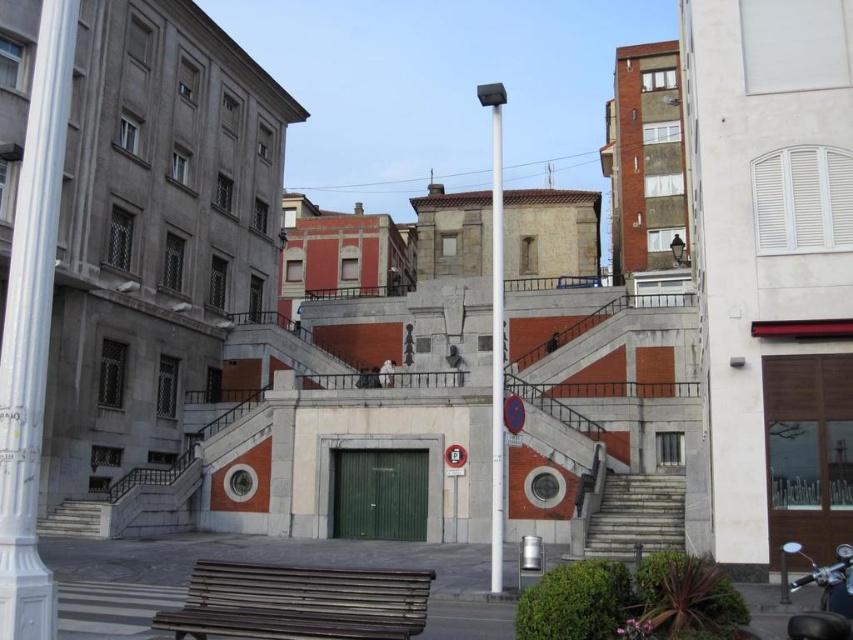
You are standing at the point marked by the coordinates point (299,602) in the cityscape image. Looking towards the central structure, which object is closer to you? The wooden bench at lower center or the small green door at its base?

The wooden bench at lower center is closer to you since you are standing at the point marked by the coordinates point (299,602), which marks its location.

You are standing at the central stone steps leading up to the platform in the cityscape image. You notice two points marked in the scene. The first point is at coordinates point (64, 129), and the second is at point (595, 538). If you were to walk directly toward the second point, would you pass by the first point before reaching it?

Yes, because point (64, 129) is in front of point (595, 538), so walking toward the second point would require passing the first one first.

In the scene shown: You are standing at the base of the cityscape and want to reach the platform with the green door. You notice the white polished column at left and the smooth concrete stairs at lower left. Which object should you approach first to ascend towards the platform?

You should approach the smooth concrete stairs at lower left first because the white polished column at left is in front of them, blocking direct access to the stairs. By moving around the column, you can reach the stairs and ascend towards the platform.